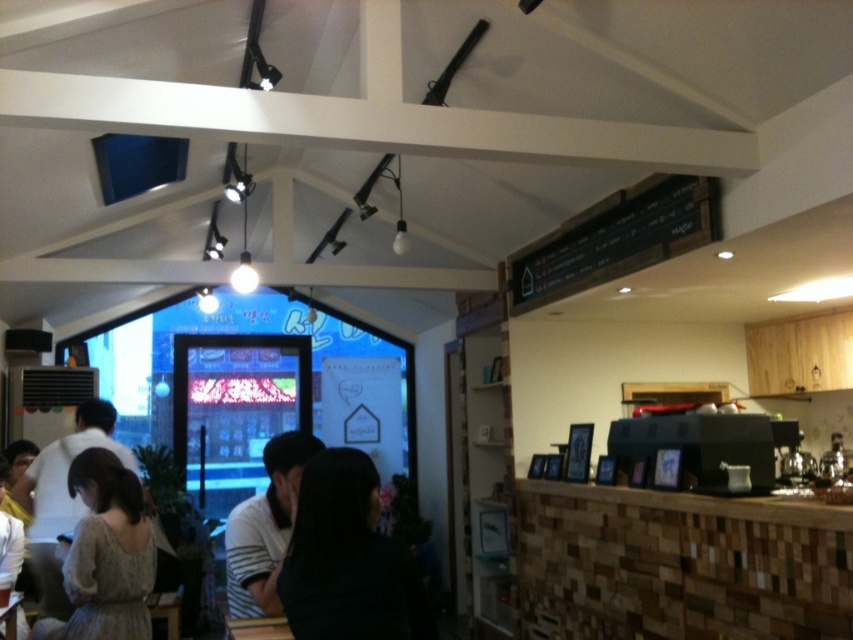
Question: Which point is farther to the camera?

Choices:
 (A) (107, 618)
 (B) (263, 611)

Answer: (A)

Question: Which point appears closest to the camera in this image?

Choices:
 (A) (397, 624)
 (B) (270, 531)
 (C) (93, 627)

Answer: (A)

Question: Considering the real-world distances, which object is farthest from the knitted sweater at lower left?

Choices:
 (A) white striped shirt at center
 (B) dark hair at center

Answer: (B)

Question: Can you confirm if knitted sweater at lower left is smaller than white striped shirt at center?

Choices:
 (A) no
 (B) yes

Answer: (A)

Question: Does dark hair at center appear on the left side of knitted sweater at lower left?

Choices:
 (A) yes
 (B) no

Answer: (B)

Question: Does dark hair at center have a lesser width compared to knitted sweater at lower left?

Choices:
 (A) yes
 (B) no

Answer: (A)